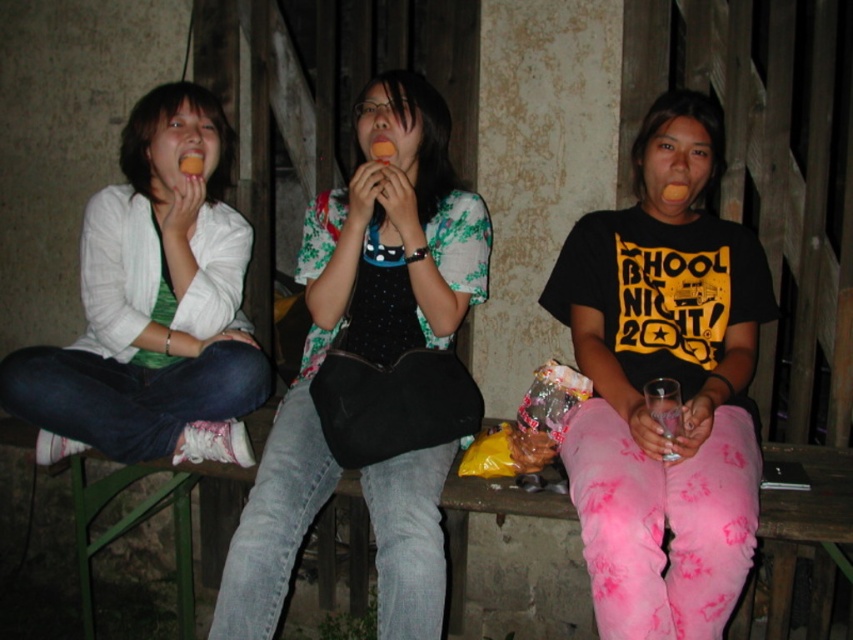
Based on the scene description, which object is taller between the floral fabric top at center and the matte white cardigan at left?

The floral fabric top at center is taller than the matte white cardigan at left according to the description.

What is the color of the clothing worn by the person located at the coordinates point (664, 378)?

The person at point (664, 378) is wearing a matte black t shirt at center.